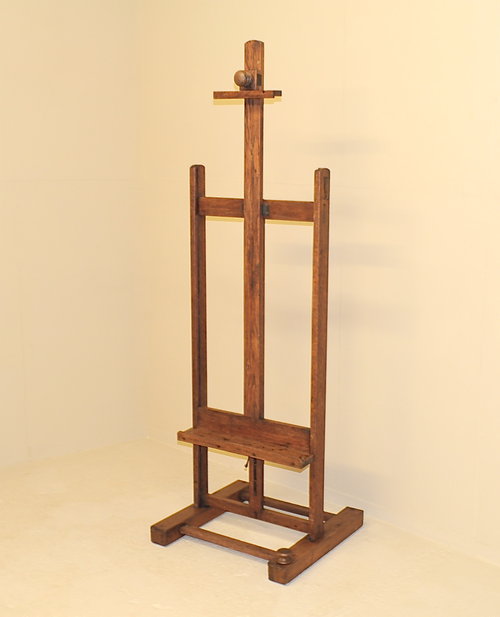
The height and width of the screenshot is (617, 500). Find the location of `rack`. rack is located at coordinates (255, 192).